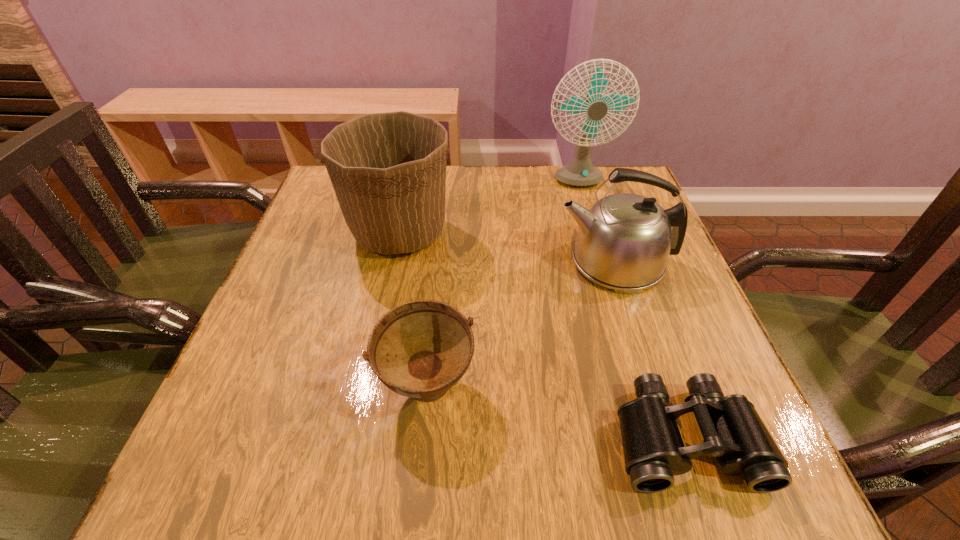
What are the coordinates of `free region located 0.280m on the spout of the kettle` in the screenshot? It's located at (429, 262).

You are a GUI agent. You are given a task and a screenshot of the screen. Output one action in this format:
    pyautogui.click(x=<x>, y=<y>)
    Task: Click on the vacant space situated 0.060m on the back of the second shortest object
    The width and height of the screenshot is (960, 540).
    Given the screenshot: What is the action you would take?
    pyautogui.click(x=433, y=325)

Where is `fan located at the far edge`? The image size is (960, 540). fan located at the far edge is located at coordinates (580, 172).

You are a GUI agent. You are given a task and a screenshot of the screen. Output one action in this format:
    pyautogui.click(x=<x>, y=<y>)
    Task: Click on the flowerpot that is at the far edge
    
    Given the screenshot: What is the action you would take?
    pyautogui.click(x=388, y=170)

Find the location of a particular element. object at the near edge is located at coordinates (733, 432).

The height and width of the screenshot is (540, 960). I want to click on object that is at the left edge, so click(x=388, y=170).

The width and height of the screenshot is (960, 540). I want to click on fan that is at the right edge, so click(x=580, y=172).

Where is `kettle that is at the right edge`? This screenshot has height=540, width=960. kettle that is at the right edge is located at coordinates (624, 241).

Identify the location of binoculars that is at the right edge. The image size is (960, 540). (733, 432).

Identify the location of object located at the far left corner. The height and width of the screenshot is (540, 960). (388, 170).